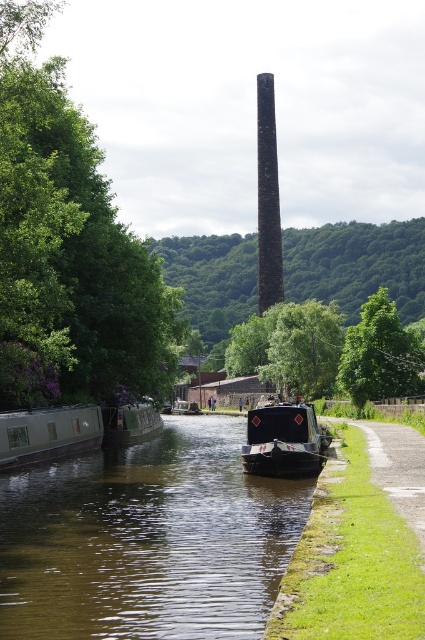
Question: Which object is the closest to the black stone chimney at center?

Choices:
 (A) matte black boat at left
 (B) black glossy boat at center
 (C) brown smooth water at center

Answer: (A)

Question: Can you confirm if matte black boat at left is wider than green matte boat at left?

Choices:
 (A) no
 (B) yes

Answer: (B)

Question: Is black glossy boat at center positioned in front of black stone chimney at center?

Choices:
 (A) no
 (B) yes

Answer: (B)

Question: Can you confirm if black glossy boat at center is positioned to the right of black stone chimney at center?

Choices:
 (A) yes
 (B) no

Answer: (B)

Question: Which of these objects is positioned closest to the matte black boat at left?

Choices:
 (A) black stone chimney at center
 (B) black glossy boat at center

Answer: (B)

Question: Which object is the farthest from the black glossy boat at center?

Choices:
 (A) matte black boat at left
 (B) brown smooth water at center
 (C) green matte boat at left
 (D) black stone chimney at center

Answer: (D)